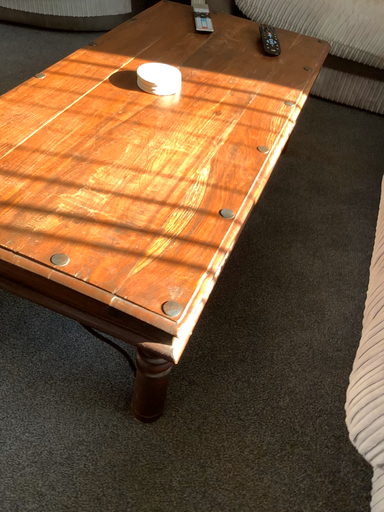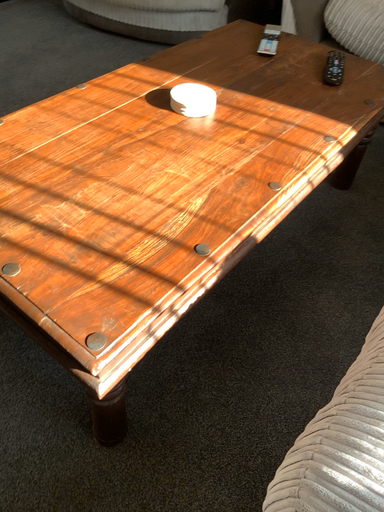
Question: Which way did the camera rotate in the video?

Choices:
 (A) rotated right
 (B) rotated left

Answer: (B)